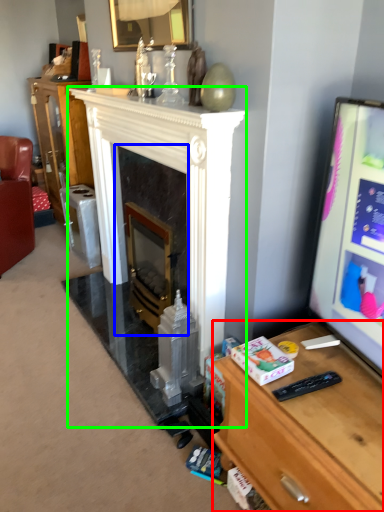
Question: Which object is positioned farthest from desk (highlighted by a red box)? Select from fireplace (highlighted by a blue box) and fireplace (highlighted by a green box).

Choices:
 (A) fireplace
 (B) fireplace

Answer: (A)